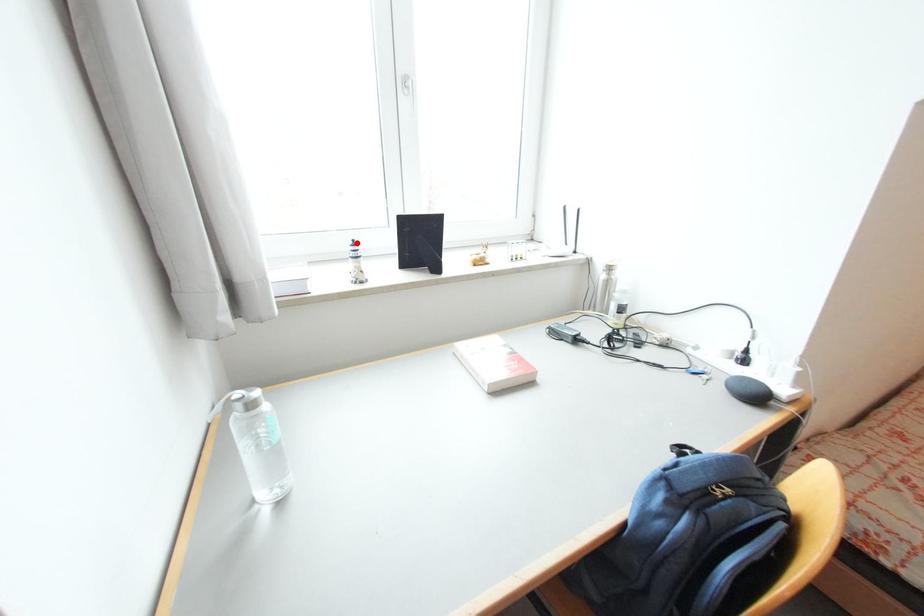
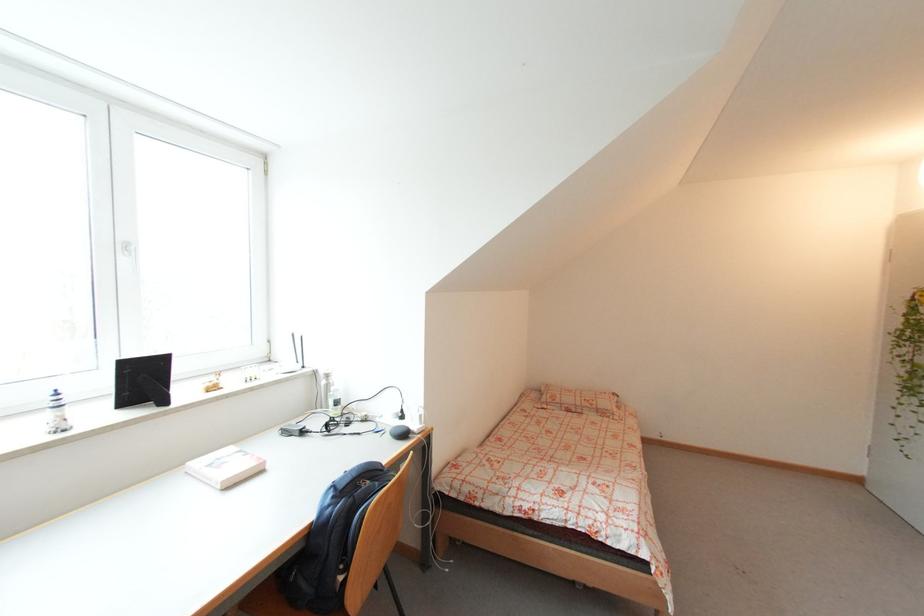
Question: I am providing you with two images of the same scene from different viewpoints. A red point is marked on the first image. Is the red point's position out of view in image 2?

Choices:
 (A) Yes
 (B) No

Answer: (B)